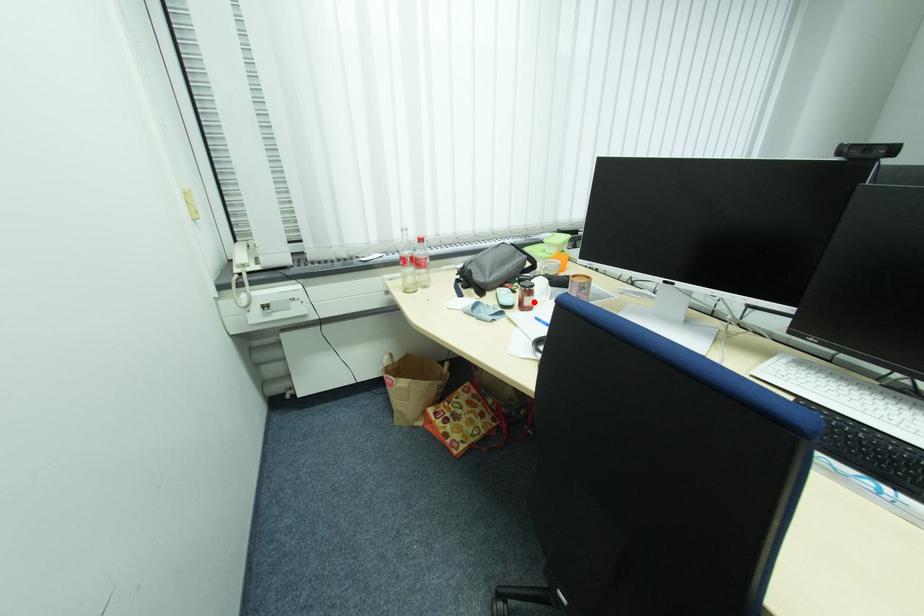
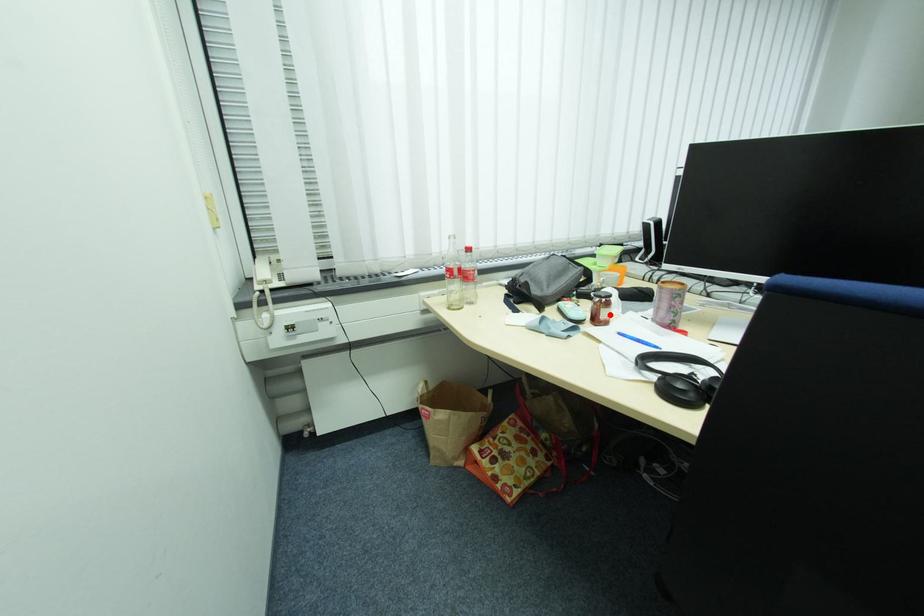
I am providing you with two images of the same scene from different viewpoints. A red point is marked on the first image and another point is marked on the second image. Is the red point in image1 aligned with the point shown in image2?

Yes